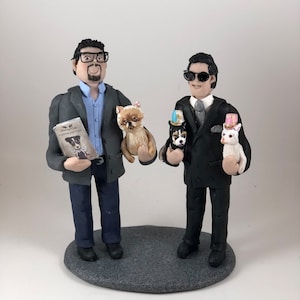
Identify the location of chest. (95, 113), (198, 124).